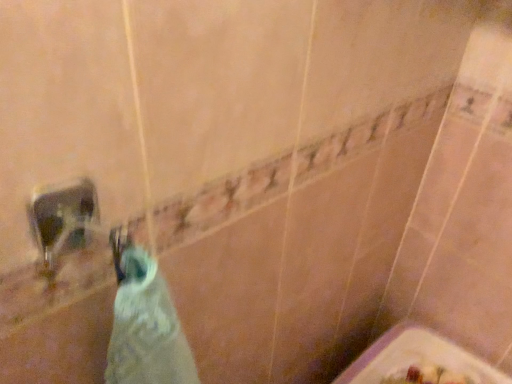
Where is `white glossy bath at lower right`? white glossy bath at lower right is located at coordinates coord(416,357).

Describe the element at coordinates (416, 357) in the screenshot. I see `white glossy bath at lower right` at that location.

Image resolution: width=512 pixels, height=384 pixels. In order to click on white glossy bath at lower right in this screenshot , I will do `click(416, 357)`.